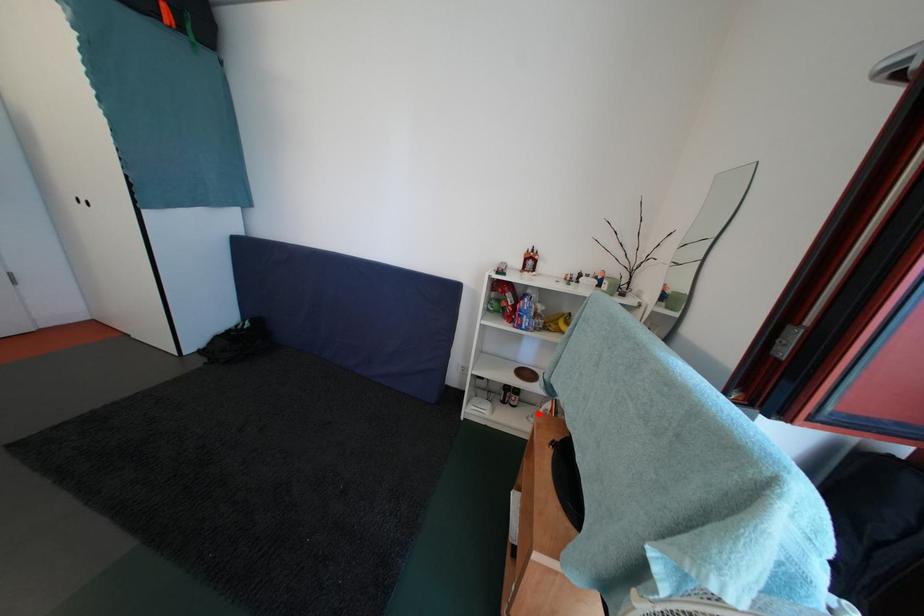
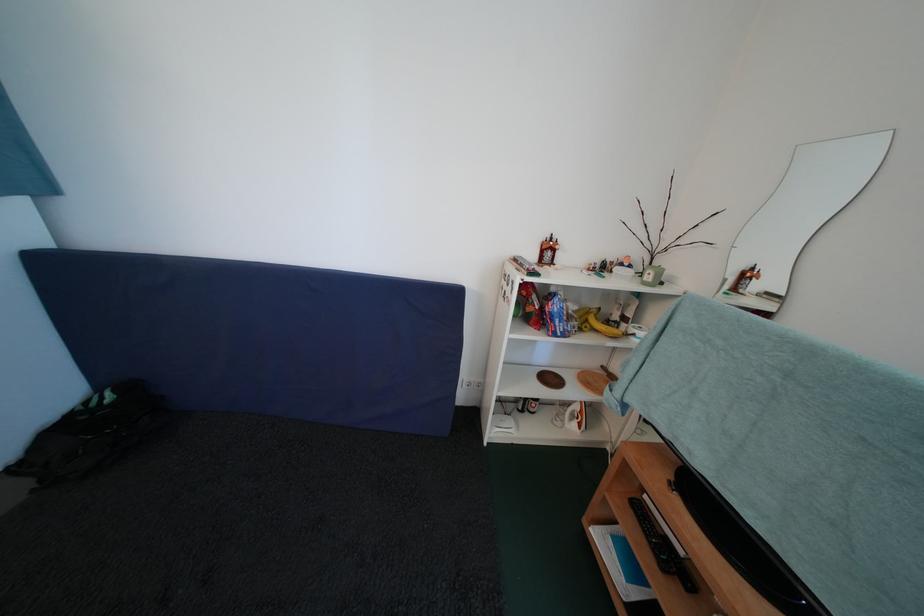
Question: I am providing you with two images of the same scene from different viewpoints. A red point is marked on the first image. Is the red point's position out of view in image 2?

Choices:
 (A) Yes
 (B) No

Answer: (B)